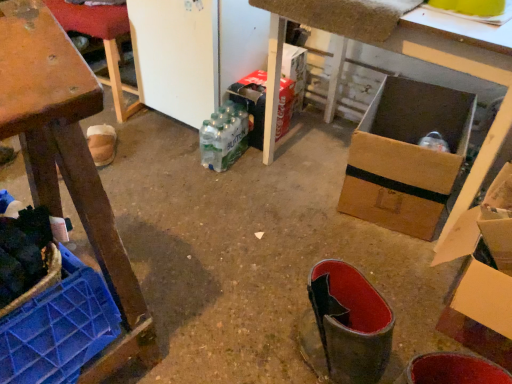
What is the approximate width of cardboard box at center, placed as the second cardboard box when sorted from right to left?

11.76 inches.

Locate an element on the screen. The width and height of the screenshot is (512, 384). cardboard box at center is located at coordinates (412, 56).

What do you see at coordinates (484, 259) in the screenshot? I see `cardboard box at right, which is counted as the 2th cardboard box, starting from the left` at bounding box center [484, 259].

What do you see at coordinates (102, 43) in the screenshot? The image size is (512, 384). I see `wooden table at left, arranged as the second furniture when viewed from the front` at bounding box center [102, 43].

Where is `cardboard box at center, placed as the second cardboard box when sorted from right to left`? Image resolution: width=512 pixels, height=384 pixels. cardboard box at center, placed as the second cardboard box when sorted from right to left is located at coordinates (252, 103).

Which point is more forward, (287, 93) or (35, 169)?

Positioned in front is point (35, 169).

Does cardboard box at center, which is counted as the 2th cardboard box, starting from the front, touch wooden crate at left, which is the 2th furniture in top-to-bottom order?

No.

How many degrees apart are the facing directions of cardboard box at center, placed as the second cardboard box when sorted from right to left, and wooden crate at left, the 2th furniture from the back?

cardboard box at center, placed as the second cardboard box when sorted from right to left, and wooden crate at left, the 2th furniture from the back, are facing 0.513 degrees away from each other.

Could wooden crate at left, which is the 2th furniture in top-to-bottom order, be considered to be inside cardboard box at center, which is counted as the 2th cardboard box, starting from the front?

No, wooden crate at left, which is the 2th furniture in top-to-bottom order, is located outside of cardboard box at center, which is counted as the 2th cardboard box, starting from the front.

From a real-world perspective, is brown cardboard box at center physically located above or below cardboard box at right, the 2th cardboard box from the back?

brown cardboard box at center is below cardboard box at right, the 2th cardboard box from the back.

In the scene shown: Is brown cardboard box at center spatially inside cardboard box at right, positioned as the 1th cardboard box in right-to-left order, or outside of it?

brown cardboard box at center is not inside cardboard box at right, positioned as the 1th cardboard box in right-to-left order, it's outside.

Could you measure the distance between brown cardboard box at center and cardboard box at right, which is counted as the 2th cardboard box, starting from the left?

The distance of brown cardboard box at center from cardboard box at right, which is counted as the 2th cardboard box, starting from the left, is 12.77 inches.

Consider the image. Relative to cardboard box at right, positioned as the 1th cardboard box in right-to-left order, is brown cardboard box at center in front or behind?

brown cardboard box at center is positioned farther from the viewer than cardboard box at right, positioned as the 1th cardboard box in right-to-left order.

From a real-world perspective, which object rests below the other?

cardboard box at center, which ranks as the 1th cardboard box in left-to-right order, from a real-world perspective.

Is cardboard box at center, positioned as the first cardboard box in back-to-front order, not close to cardboard box at center?

cardboard box at center, positioned as the first cardboard box in back-to-front order, is actually quite close to cardboard box at center.

Is point (261, 88) positioned before point (479, 64)?

No, (261, 88) is further to viewer.

Could you tell me if cardboard box at center, positioned as the first cardboard box in back-to-front order, is turned towards cardboard box at center?

No.

Does point (509, 172) come behind point (257, 76)?

No.

Considering the sizes of cardboard box at right, arranged as the 1th cardboard box when viewed from the front, and cardboard box at center, which is counted as the 2th cardboard box, starting from the front, in the image, is cardboard box at right, arranged as the 1th cardboard box when viewed from the front, bigger or smaller than cardboard box at center, which is counted as the 2th cardboard box, starting from the front,?

Clearly, cardboard box at right, arranged as the 1th cardboard box when viewed from the front, is larger in size than cardboard box at center, which is counted as the 2th cardboard box, starting from the front.

At what (x,y) coordinates should I click in order to perform the action: click on cardboard box that is behind the cardboard box at right, arranged as the 1th cardboard box when viewed from the front. Please return your answer as a coordinate pair (x, y). This screenshot has height=384, width=512. Looking at the image, I should click on (252, 103).

Is wooden table at left, placed as the 1th furniture when sorted from top to bottom, situated inside brown cardboard box at center or outside?

wooden table at left, placed as the 1th furniture when sorted from top to bottom, is not enclosed by brown cardboard box at center.

Considering the sizes of wooden table at left, the 2th furniture ordered from the bottom, and brown cardboard box at center in the image, is wooden table at left, the 2th furniture ordered from the bottom, taller or shorter than brown cardboard box at center?

Clearly, wooden table at left, the 2th furniture ordered from the bottom, is taller compared to brown cardboard box at center.

Are wooden table at left, the 2th furniture ordered from the bottom, and brown cardboard box at center making contact?

wooden table at left, the 2th furniture ordered from the bottom, is not next to brown cardboard box at center, and they're not touching.

Which is closer to the camera, [105,246] or [122,35]?

Point [105,246] is positioned closer to the camera compared to point [122,35].

You are a GUI agent. You are given a task and a screenshot of the screen. Output one action in this format:
    pyautogui.click(x=<x>, y=<y>)
    Task: Click on the furniture that appears below the wooden crate at left, the first furniture from the bottom (from a real-world perspective)
    This screenshot has height=384, width=512.
    Given the screenshot: What is the action you would take?
    pyautogui.click(x=102, y=43)

In terms of size, does wooden crate at left, the 2th furniture from the back, appear bigger or smaller than wooden table at left, arranged as the second furniture when viewed from the front?

In the image, wooden crate at left, the 2th furniture from the back, appears to be larger than wooden table at left, arranged as the second furniture when viewed from the front.

Is cardboard box at center taller or shorter than brown cardboard box at center?

In the image, cardboard box at center appears to be taller than brown cardboard box at center.

From the image's perspective, is cardboard box at center on brown cardboard box at center?

Correct, cardboard box at center appears higher than brown cardboard box at center in the image.

In the scene shown: What's the angular difference between cardboard box at center and brown cardboard box at center's facing directions?

The facing directions of cardboard box at center and brown cardboard box at center are 15.4 degrees apart.

Which object is closer to the camera, cardboard box at center or brown cardboard box at center?

cardboard box at center is more forward.

Locate an element on the screen. cardboard box that is the 2nd object located above the wooden crate at left, the first furniture from the bottom (from the image's perspective) is located at coordinates (252, 103).

Locate an element on the screen. Image resolution: width=512 pixels, height=384 pixels. cardboard box below the brown cardboard box at center (from the image's perspective) is located at coordinates (484, 259).

When comparing their distances from brown cardboard box at center, does wooden table at left, arranged as the first furniture when viewed from the back, or cardboard box at right, arranged as the 1th cardboard box when viewed from the front, seem further?

wooden table at left, arranged as the first furniture when viewed from the back, is positioned further to the anchor brown cardboard box at center.

Looking at the image, which one is located further to cardboard box at center, positioned as the first cardboard box in back-to-front order, brown cardboard box at center or wooden crate at left, the first furniture from the bottom?

Among the two, wooden crate at left, the first furniture from the bottom, is located further to cardboard box at center, positioned as the first cardboard box in back-to-front order.

Estimate the real-world distances between objects in this image. Which object is closer to cardboard box at center, wooden crate at left, the first furniture from the bottom, or brown cardboard box at center?

brown cardboard box at center lies closer to cardboard box at center than the other object.

From the image, which object appears to be nearer to wooden table at left, arranged as the first furniture when viewed from the back, cardboard box at center or cardboard box at center, which is counted as the 2th cardboard box, starting from the front?

cardboard box at center, which is counted as the 2th cardboard box, starting from the front, is closer to wooden table at left, arranged as the first furniture when viewed from the back.

From the image, which object appears to be farther from cardboard box at center, placed as the second cardboard box when sorted from right to left, wooden crate at left, which is the 2th furniture in top-to-bottom order, or cardboard box at center?

Among the two, wooden crate at left, which is the 2th furniture in top-to-bottom order, is located further to cardboard box at center, placed as the second cardboard box when sorted from right to left.

Based on the photo, estimate the real-world distances between objects in this image. Which object is closer to wooden crate at left, the first furniture from the bottom, brown cardboard box at center or cardboard box at right, arranged as the 1th cardboard box when viewed from the front?

cardboard box at right, arranged as the 1th cardboard box when viewed from the front.

Looking at the image, which one is located closer to cardboard box at right, arranged as the 1th cardboard box when viewed from the front, cardboard box at center, positioned as the first cardboard box in back-to-front order, or wooden table at left, arranged as the second furniture when viewed from the front?

Among the two, cardboard box at center, positioned as the first cardboard box in back-to-front order, is located nearer to cardboard box at right, arranged as the 1th cardboard box when viewed from the front.

Based on their spatial positions, is cardboard box at center or wooden table at left, arranged as the first furniture when viewed from the back, closer to brown cardboard box at center?

cardboard box at center.

Where is `table situated between wooden crate at left, the first furniture from the bottom, and brown cardboard box at center from left to right`? The width and height of the screenshot is (512, 384). table situated between wooden crate at left, the first furniture from the bottom, and brown cardboard box at center from left to right is located at coordinates (412, 56).

At what (x,y) coordinates should I click in order to perform the action: click on table between wooden table at left, arranged as the first furniture when viewed from the back, and brown cardboard box at center. Please return your answer as a coordinate pair (x, y). The width and height of the screenshot is (512, 384). Looking at the image, I should click on (412, 56).

The height and width of the screenshot is (384, 512). I want to click on furniture between wooden crate at left, the first furniture from the bottom, and cardboard box at center, which is counted as the 2th cardboard box, starting from the front, along the z-axis, so click(x=102, y=43).

The height and width of the screenshot is (384, 512). I want to click on box located between wooden crate at left, the first furniture from the bottom, and cardboard box at center, positioned as the first cardboard box in back-to-front order, in the depth direction, so click(406, 156).